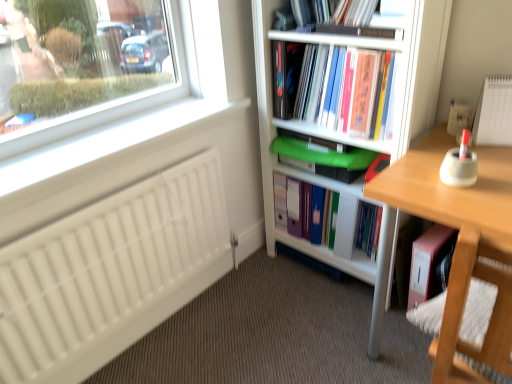
The width and height of the screenshot is (512, 384). Describe the element at coordinates (462, 244) in the screenshot. I see `wooden desk at right` at that location.

Find the location of a particular element. The height and width of the screenshot is (384, 512). pink matte folder at lower right, the fifth book viewed from the top is located at coordinates (429, 262).

What do you see at coordinates (338, 210) in the screenshot? I see `green plastic folder at center, which ranks as the 2th book in bottom-to-top order` at bounding box center [338, 210].

Looking at this image, measure the distance between green plastic folder at center, which ranks as the 2th book in bottom-to-top order, and camera.

1.58 meters.

This screenshot has height=384, width=512. What do you see at coordinates (111, 273) in the screenshot? I see `white matte radiator at lower left` at bounding box center [111, 273].

Describe the element at coordinates (322, 156) in the screenshot. I see `green plastic tray at center, the 3th book viewed from the top` at that location.

Where is `green plastic tray at center, the 3th book viewed from the top`? The image size is (512, 384). green plastic tray at center, the 3th book viewed from the top is located at coordinates (322, 156).

The height and width of the screenshot is (384, 512). In order to click on matte plastic shelf at center in this screenshot , I will do `click(332, 257)`.

Image resolution: width=512 pixels, height=384 pixels. I want to click on wooden desk at right, so click(462, 244).

Which is more to the right, hardcover book at upper center or white plastic bookcase at center?

Positioned to the right is white plastic bookcase at center.

In the scene shown: Can we say hardcover book at upper center lies outside white plastic bookcase at center?

No, hardcover book at upper center is inside or overlapping with white plastic bookcase at center.

From a real-world perspective, relative to white plastic bookcase at center, is hardcover book at upper center vertically above or below?

In terms of real-world spatial position, hardcover book at upper center is above white plastic bookcase at center.

Can you confirm if hardcover book at upper center is bigger than white plastic bookcase at center?

Incorrect, hardcover book at upper center is not larger than white plastic bookcase at center.

Is white plastic bookcase at center oriented towards matte plastic shelf at center?

No, white plastic bookcase at center is not facing towards matte plastic shelf at center.

From a real-world perspective, is white plastic bookcase at center on matte plastic shelf at center?

Yes.

Considering the positions of objects white plastic bookcase at center and matte plastic shelf at center in the image provided, who is more to the right, white plastic bookcase at center or matte plastic shelf at center?

white plastic bookcase at center.

Does wooden swivel chair at lower right lie behind white plastic bookcase at center?

No, the depth of wooden swivel chair at lower right is less than that of white plastic bookcase at center.

Considering the sizes of objects wooden swivel chair at lower right and white plastic bookcase at center in the image provided, who is smaller, wooden swivel chair at lower right or white plastic bookcase at center?

wooden swivel chair at lower right.

Is wooden swivel chair at lower right situated inside white plastic bookcase at center or outside?

wooden swivel chair at lower right exists outside the volume of white plastic bookcase at center.

From a real-world perspective, which is physically above, wooden swivel chair at lower right or white plastic bookcase at center?

From a 3D spatial view, white plastic bookcase at center is above.

Is pink matte folder at lower right, the fifth book viewed from the top, oriented away from white matte radiator at lower left?

No, pink matte folder at lower right, the fifth book viewed from the top,'s orientation is not away from white matte radiator at lower left.

Based on the photo, is pink matte folder at lower right, placed as the 1th book when sorted from bottom to top, taller or shorter than white matte radiator at lower left?

Considering their sizes, pink matte folder at lower right, placed as the 1th book when sorted from bottom to top, has less height than white matte radiator at lower left.

Is the position of pink matte folder at lower right, placed as the 1th book when sorted from bottom to top, more distant than that of white matte radiator at lower left?

Yes, pink matte folder at lower right, placed as the 1th book when sorted from bottom to top, is behind white matte radiator at lower left.

Which of these two, white matte radiator at lower left or hardcover book at upper center, the 5th book ordered from the bottom, is smaller?

hardcover book at upper center, the 5th book ordered from the bottom, is smaller.

Is there a large distance between white matte radiator at lower left and hardcover book at upper center, the 5th book ordered from the bottom?

Yes.

Who is shorter, white matte radiator at lower left or hardcover book at upper center, the 1th book in the top-to-bottom sequence?

hardcover book at upper center, the 1th book in the top-to-bottom sequence, is shorter.

Which of these two, white matte radiator at lower left or hardcover book at upper center, is thinner?

white matte radiator at lower left.

Where is `paperback book lying on the right of white matte radiator at lower left`? This screenshot has height=384, width=512. paperback book lying on the right of white matte radiator at lower left is located at coordinates (286, 76).

How different are the orientations of white matte radiator at lower left and hardcover book at upper center in degrees?

The facing directions of white matte radiator at lower left and hardcover book at upper center are 90.1 degrees apart.

From the picture: Is green plastic folder at center, the fourth book from the top, wider or thinner than hardcover book at upper center?

green plastic folder at center, the fourth book from the top, is thinner than hardcover book at upper center.

Which is closer, (303,178) or (293,67)?

Positioned in front is point (293,67).

Considering the relative positions of green plastic folder at center, which ranks as the 2th book in bottom-to-top order, and hardcover book at upper center in the image provided, is green plastic folder at center, which ranks as the 2th book in bottom-to-top order, behind hardcover book at upper center?

Yes, green plastic folder at center, which ranks as the 2th book in bottom-to-top order, is behind hardcover book at upper center.

What's the angular difference between green plastic folder at center, which ranks as the 2th book in bottom-to-top order, and hardcover book at upper center's facing directions?

The facing directions of green plastic folder at center, which ranks as the 2th book in bottom-to-top order, and hardcover book at upper center are 0.544 degrees apart.

Locate an element on the screen. This screenshot has height=384, width=512. bookcase located underneath the hardcover book at upper center (from a real-world perspective) is located at coordinates 317,184.

I want to click on bookcase on the right of matte plastic shelf at center, so click(x=317, y=184).

From the image, which object appears to be farther from green plastic folder at center, which ranks as the 2th book in bottom-to-top order, matte plastic shelf at center or wooden swivel chair at lower right?

wooden swivel chair at lower right lies further to green plastic folder at center, which ranks as the 2th book in bottom-to-top order, than the other object.

When comparing their distances from green plastic folder at center, the fourth book from the top, does hardcover book at center, the 2th book viewed from the top, or pink matte folder at lower right, placed as the 1th book when sorted from bottom to top, seem closer?

The object closer to green plastic folder at center, the fourth book from the top, is pink matte folder at lower right, placed as the 1th book when sorted from bottom to top.

When comparing their distances from green plastic folder at center, which ranks as the 2th book in bottom-to-top order, does green plastic tray at center, marked as the third book in a bottom-to-top arrangement, or wooden swivel chair at lower right seem closer?

green plastic tray at center, marked as the third book in a bottom-to-top arrangement.

Considering their positions, is hardcover book at center, the 2th book viewed from the top, positioned further to green plastic folder at center, the fourth book from the top, than green plastic tray at center, marked as the third book in a bottom-to-top arrangement?

hardcover book at center, the 2th book viewed from the top, is further to green plastic folder at center, the fourth book from the top.

Looking at the image, which one is located further to white plastic bookcase at center, pink matte folder at lower right, the fifth book viewed from the top, or hardcover book at upper center?

pink matte folder at lower right, the fifth book viewed from the top, is positioned further to the anchor white plastic bookcase at center.

Estimate the real-world distances between objects in this image. Which object is closer to wooden swivel chair at lower right, white matte radiator at lower left or hardcover book at upper center, the 5th book ordered from the bottom?

Based on the image, hardcover book at upper center, the 5th book ordered from the bottom, appears to be nearer to wooden swivel chair at lower right.

Based on their spatial positions, is white matte radiator at lower left or green plastic tray at center, marked as the third book in a bottom-to-top arrangement, closer to hardcover book at center, the 2th book viewed from the top?

green plastic tray at center, marked as the third book in a bottom-to-top arrangement, is positioned closer to the anchor hardcover book at center, the 2th book viewed from the top.

Considering their positions, is hardcover book at upper center, the 1th book in the top-to-bottom sequence, positioned closer to white matte radiator at lower left than hardcover book at center, the 2th book viewed from the top?

hardcover book at center, the 2th book viewed from the top.

Where is `bookcase that lies between hardcover book at upper center, the 1th book in the top-to-bottom sequence, and wooden swivel chair at lower right from top to bottom`? The image size is (512, 384). bookcase that lies between hardcover book at upper center, the 1th book in the top-to-bottom sequence, and wooden swivel chair at lower right from top to bottom is located at coordinates (317, 184).

The width and height of the screenshot is (512, 384). Identify the location of desk between hardcover book at center, positioned as the 4th book in bottom-to-top order, and wooden swivel chair at lower right from top to bottom. (462, 244).

Find the location of a particular element. paperback book situated between white matte radiator at lower left and wooden desk at right from left to right is located at coordinates (286, 76).

Identify the location of bookcase between hardcover book at center, positioned as the 4th book in bottom-to-top order, and pink matte folder at lower right, the fifth book viewed from the top, in the up-down direction. (317, 184).